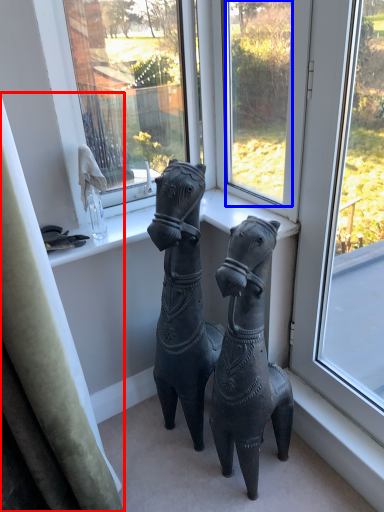
Question: Among these objects, which one is farthest to the camera, curtain (highlighted by a red box) or window (highlighted by a blue box)?

Choices:
 (A) curtain
 (B) window

Answer: (B)